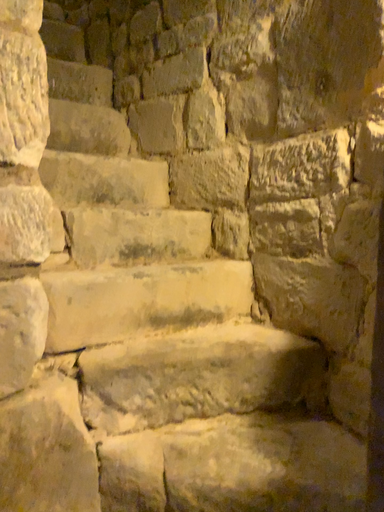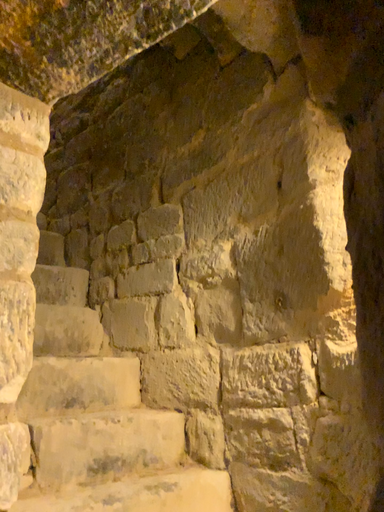
Question: How did the camera likely rotate when shooting the video?

Choices:
 (A) rotated downward
 (B) rotated upward

Answer: (B)